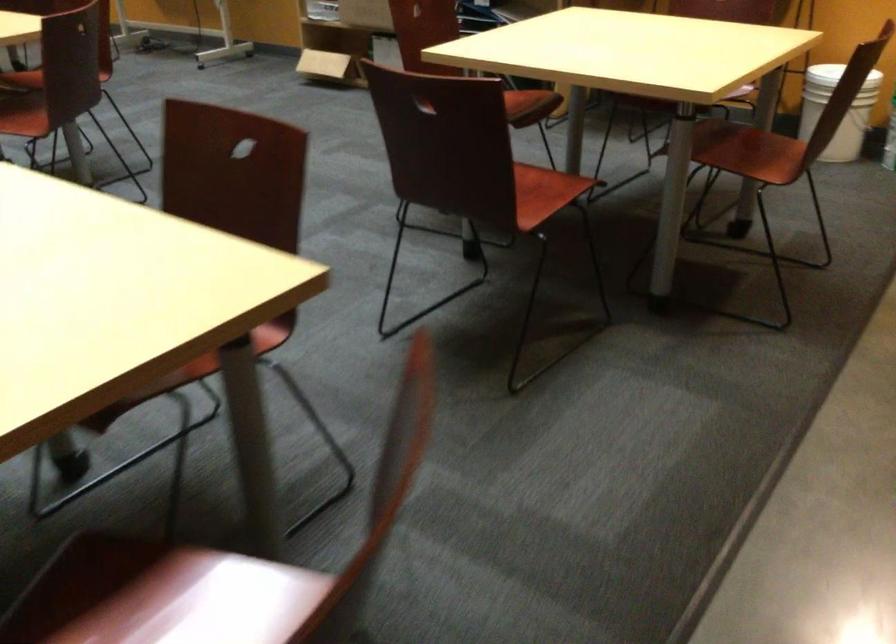
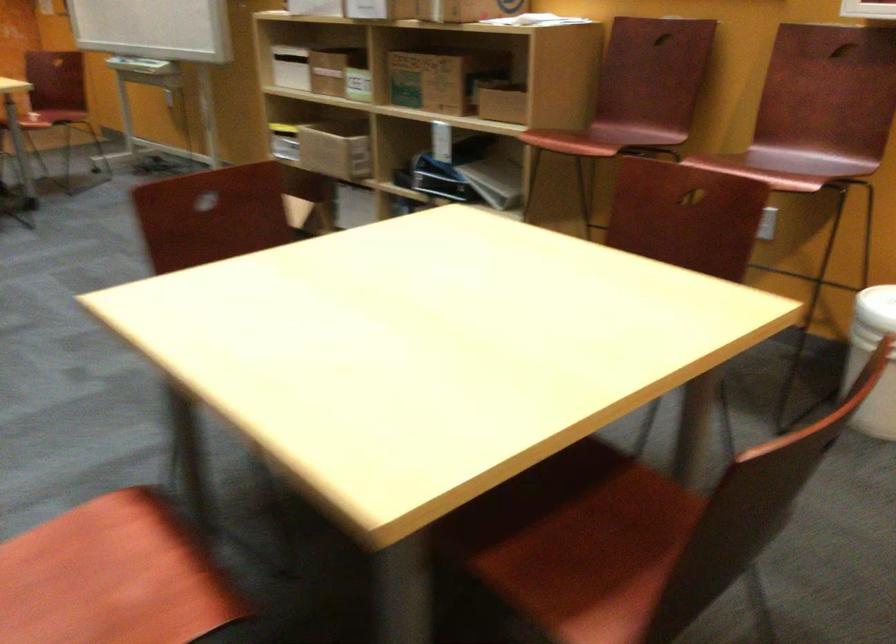
First-person continuous shooting, in which direction is the camera rotating?

The camera's rotation is toward right-down.